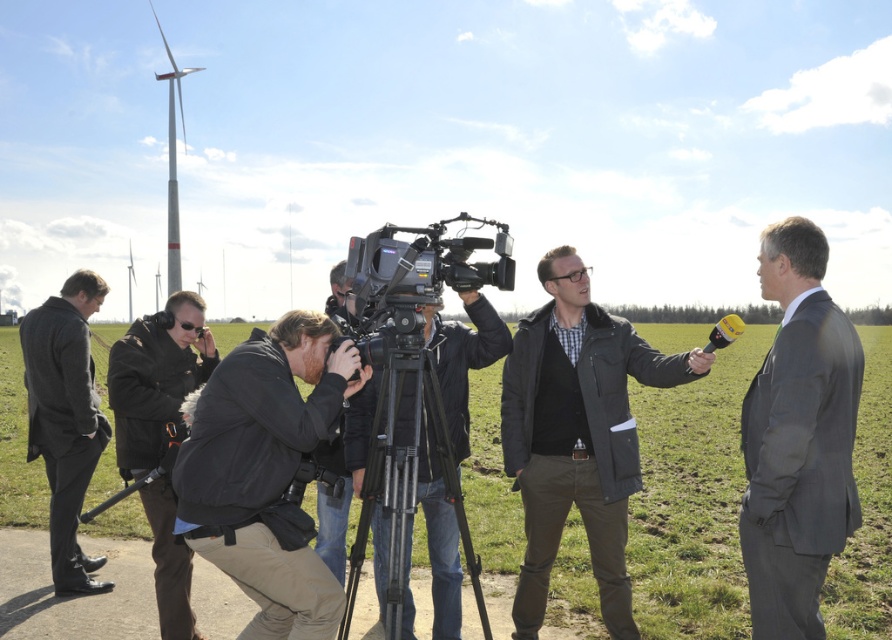
Can you confirm if gray wool suit at right is positioned above dark gray wool coat at left?

Yes, gray wool suit at right is above dark gray wool coat at left.

Is gray wool suit at right shorter than dark gray wool coat at left?

Indeed, gray wool suit at right has a lesser height compared to dark gray wool coat at left.

What do you see at coordinates (797, 438) in the screenshot?
I see `gray wool suit at right` at bounding box center [797, 438].

Locate an element on the screen. The width and height of the screenshot is (892, 640). gray wool suit at right is located at coordinates (797, 438).

This screenshot has width=892, height=640. What do you see at coordinates (692, 499) in the screenshot?
I see `green grass at center` at bounding box center [692, 499].

Find the location of `green grass at center`. green grass at center is located at coordinates (692, 499).

Between point (234, 486) and point (402, 627), which one is positioned in front?

Positioned in front is point (234, 486).

Which is more to the right, black matte jacket at center or silver metallic tripod at center?

From the viewer's perspective, silver metallic tripod at center appears more on the right side.

Between point (195, 547) and point (392, 595), which one is positioned behind?

Positioned behind is point (392, 595).

Where is `black matte jacket at center`? The height and width of the screenshot is (640, 892). black matte jacket at center is located at coordinates (266, 472).